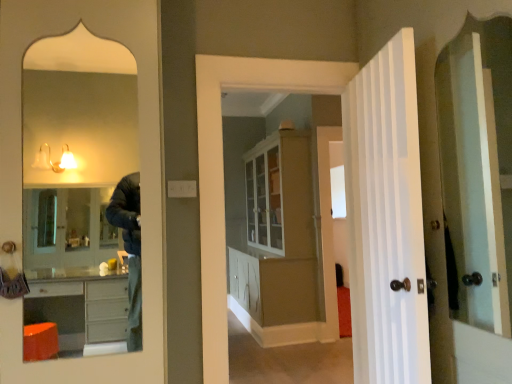
Question: From a real-world perspective, is white glossy cabinet at center physically located above or below white painted wood door at right?

Choices:
 (A) above
 (B) below

Answer: (B)

Question: In terms of width, does white glossy cabinet at center look wider or thinner when compared to white painted wood door at right?

Choices:
 (A) thin
 (B) wide

Answer: (B)

Question: Is white glossy cabinet at center inside or outside of white painted wood door at right?

Choices:
 (A) outside
 (B) inside

Answer: (A)

Question: Would you say white painted wood door at right is to the left or to the right of white glossy cabinet at center in the picture?

Choices:
 (A) right
 (B) left

Answer: (A)

Question: From a real-world perspective, is white painted wood door at right above or below white glossy cabinet at center?

Choices:
 (A) below
 (B) above

Answer: (B)

Question: Does point (358, 210) appear closer or farther from the camera than point (283, 248)?

Choices:
 (A) farther
 (B) closer

Answer: (B)

Question: Is white painted wood door at right situated inside white glossy cabinet at center or outside?

Choices:
 (A) inside
 (B) outside

Answer: (B)